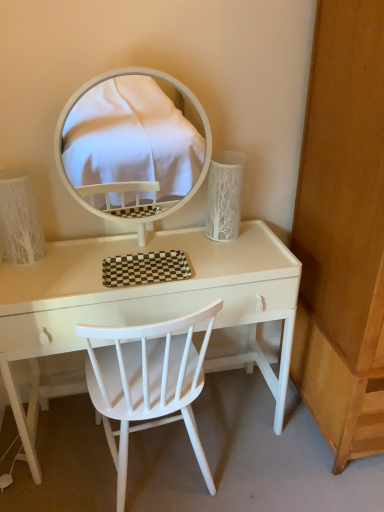
Question: Would you say white wood chair at center is inside or outside white textured lampshade at left, which appears as the 2th table lamp when viewed from the right?

Choices:
 (A) outside
 (B) inside

Answer: (A)

Question: Is white wood chair at center wider or thinner than white textured lampshade at left, which appears as the 2th table lamp when viewed from the right?

Choices:
 (A) thin
 (B) wide

Answer: (B)

Question: Estimate the real-world distances between objects in this image. Which object is closer to the white textured lampshade at left, which appears as the 2th table lamp when viewed from the right?

Choices:
 (A) white textured vase at right, which is the 2th table lamp from left to right
 (B) wooden dresser at right
 (C) white wood chair at center
 (D) white glossy table at center
 (E) white glossy mirror at upper center

Answer: (D)

Question: Which of these objects is positioned closest to the wooden dresser at right?

Choices:
 (A) white textured vase at right, which is the first table lamp from right to left
 (B) white glossy mirror at upper center
 (C) white wood chair at center
 (D) white glossy table at center
 (E) white textured lampshade at left, which appears as the 2th table lamp when viewed from the right

Answer: (A)